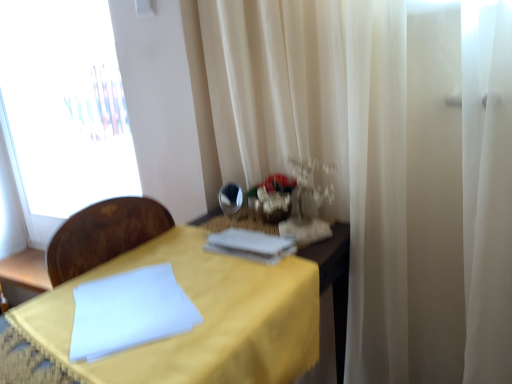
What is the approximate height of white paper at center?

white paper at center is 1.60 inches in height.

The height and width of the screenshot is (384, 512). I want to click on shiny silver mirror at center, so click(x=231, y=198).

The height and width of the screenshot is (384, 512). Describe the element at coordinates (203, 316) in the screenshot. I see `yellow fabric table at center` at that location.

Where is `yellow fabric table at center`? The width and height of the screenshot is (512, 384). yellow fabric table at center is located at coordinates (203, 316).

Where is `white paper at center`? white paper at center is located at coordinates (251, 245).

From the image's perspective, is yellow fabric table at center located above or below transparent glass window at left?

Result: From the image's perspective, yellow fabric table at center appears below transparent glass window at left.

Is yellow fabric table at center not near transparent glass window at left?

Yes, yellow fabric table at center and transparent glass window at left are located far from each other.

Can you confirm if yellow fabric table at center is wider than transparent glass window at left?

Correct, the width of yellow fabric table at center exceeds that of transparent glass window at left.

Considering the relative sizes of yellow fabric table at center and transparent glass window at left in the image provided, is yellow fabric table at center shorter than transparent glass window at left?

Correct, yellow fabric table at center is not as tall as transparent glass window at left.

Is transparent glass window at left touching shiny silver mirror at center?

No.

From a real-world perspective, is transparent glass window at left above or below shiny silver mirror at center?

transparent glass window at left is above shiny silver mirror at center.

How many degrees apart are the facing directions of transparent glass window at left and shiny silver mirror at center?

11.5 degrees.

Which object is wider, transparent glass window at left or shiny silver mirror at center?

Wider between the two is transparent glass window at left.

From the picture: Can you tell me how much yellow fabric table at center and white paper at center differ in facing direction?

The facing directions of yellow fabric table at center and white paper at center are 2.95 degrees apart.

Considering the sizes of objects yellow fabric table at center and white paper at center in the image provided, who is bigger, yellow fabric table at center or white paper at center?

yellow fabric table at center is bigger.

In the scene shown: From the image's perspective, which one is positioned lower, yellow fabric table at center or white paper at center?

yellow fabric table at center.

Between yellow fabric table at center and white paper at center, which one is positioned behind?

Positioned behind is white paper at center.

Considering the relative positions of shiny silver mirror at center and white paper at center in the image provided, is shiny silver mirror at center to the left or to the right of white paper at center?

Based on their positions, shiny silver mirror at center is located to the left of white paper at center.

From the image's perspective, would you say shiny silver mirror at center is positioned over white paper at center?

Indeed, from the image's perspective, shiny silver mirror at center is shown above white paper at center.

In the scene shown: Is shiny silver mirror at center surrounding white paper at center?

Definitely not — white paper at center is not inside shiny silver mirror at center.

Is shiny silver mirror at center taller than white paper at center?

Correct, shiny silver mirror at center is much taller as white paper at center.

Considering the positions of objects shiny silver mirror at center and transparent glass window at left in the image provided, who is in front, shiny silver mirror at center or transparent glass window at left?

Positioned in front is shiny silver mirror at center.

Is shiny silver mirror at center oriented away from transparent glass window at left?

That's not correct — shiny silver mirror at center is not looking away from transparent glass window at left.

Is shiny silver mirror at center thinner than transparent glass window at left?

Correct, the width of shiny silver mirror at center is less than that of transparent glass window at left.

Could transparent glass window at left be considered to be inside shiny silver mirror at center?

That's incorrect, transparent glass window at left is not inside shiny silver mirror at center.

Looking at this image, from their relative heights in the image, would you say white paper at center is taller or shorter than yellow fabric table at center?

white paper at center is shorter than yellow fabric table at center.

Does point (265, 235) come in front of point (188, 343)?

No, (265, 235) is further to viewer.

Is white paper at center inside or outside of yellow fabric table at center?

white paper at center is inside yellow fabric table at center.

Is the surface of transparent glass window at left in direct contact with yellow fabric table at center?

transparent glass window at left is not next to yellow fabric table at center, and they're not touching.

Is transparent glass window at left situated inside yellow fabric table at center or outside?

transparent glass window at left is not inside yellow fabric table at center, it's outside.

Which is more to the right, transparent glass window at left or yellow fabric table at center?

Positioned to the right is yellow fabric table at center.

Measure the distance between transparent glass window at left and yellow fabric table at center.

transparent glass window at left is 1.77 meters from yellow fabric table at center.

At what (x,y) coordinates should I click in order to perform the action: click on window above the yellow fabric table at center (from a real-world perspective). Please return your answer as a coordinate pair (x, y). The height and width of the screenshot is (384, 512). Looking at the image, I should click on (63, 109).

Find the location of a particular element. This screenshot has height=384, width=512. window on the left of shiny silver mirror at center is located at coordinates (63, 109).

From the image, which object appears to be farther from yellow fabric table at center, shiny silver mirror at center or white paper at center?

Based on the image, shiny silver mirror at center appears to be further to yellow fabric table at center.

Based on their spatial positions, is white paper at center or transparent glass window at left closer to yellow fabric table at center?

white paper at center.

Looking at the image, which one is located further to transparent glass window at left, shiny silver mirror at center or yellow fabric table at center?

Based on the image, yellow fabric table at center appears to be further to transparent glass window at left.

Considering their positions, is yellow fabric table at center positioned further to shiny silver mirror at center than white paper at center?

yellow fabric table at center.

Looking at the image, which one is located closer to transparent glass window at left, yellow fabric table at center or white paper at center?

Based on the image, yellow fabric table at center appears to be nearer to transparent glass window at left.

From the picture: When comparing their distances from shiny silver mirror at center, does white paper at center or yellow fabric table at center seem further?

yellow fabric table at center.

Looking at the image, which one is located further to white paper at center, shiny silver mirror at center or yellow fabric table at center?

Based on the image, shiny silver mirror at center appears to be further to white paper at center.

Which object lies further to the anchor point shiny silver mirror at center, white paper at center or transparent glass window at left?

Among the two, transparent glass window at left is located further to shiny silver mirror at center.

This screenshot has height=384, width=512. Find the location of `mirror positioned between yellow fabric table at center and transparent glass window at left from near to far`. mirror positioned between yellow fabric table at center and transparent glass window at left from near to far is located at coordinates [x=231, y=198].

You are a GUI agent. You are given a task and a screenshot of the screen. Output one action in this format:
    pyautogui.click(x=<x>, y=<y>)
    Task: Click on the book between yellow fabric table at center and shiny silver mirror at center along the z-axis
    Image resolution: width=512 pixels, height=384 pixels.
    Given the screenshot: What is the action you would take?
    pyautogui.click(x=251, y=245)

Where is `book positioned between yellow fabric table at center and transparent glass window at left from near to far`? The image size is (512, 384). book positioned between yellow fabric table at center and transparent glass window at left from near to far is located at coordinates (251, 245).

Locate an element on the screen. The height and width of the screenshot is (384, 512). mirror situated between transparent glass window at left and white paper at center from left to right is located at coordinates (231, 198).